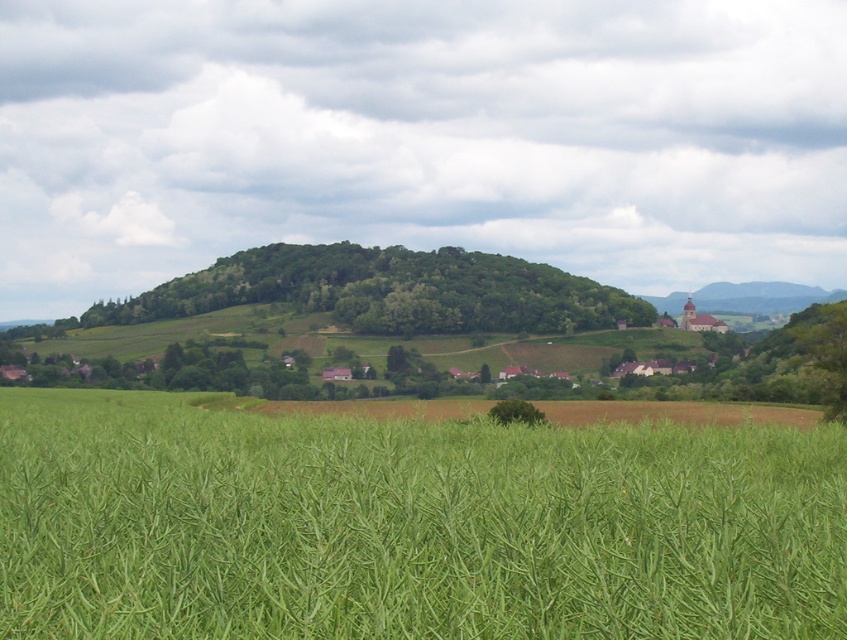
Question: Among these objects, which one is farthest from the camera?

Choices:
 (A) green leafy tree at center
 (B) matte brown church at right

Answer: (B)

Question: Which of these objects is positioned closest to the matte brown church at right?

Choices:
 (A) green grassy field at lower center
 (B) green leafy hill at center
 (C) green leafy tree at center

Answer: (B)

Question: Does green grassy field at lower center have a smaller size compared to matte brown church at right?

Choices:
 (A) yes
 (B) no

Answer: (A)

Question: Considering the relative positions of green grassy field at lower center and green leafy hill at center in the image provided, where is green grassy field at lower center located with respect to green leafy hill at center?

Choices:
 (A) right
 (B) left

Answer: (A)

Question: Which of these objects is positioned closest to the matte brown church at right?

Choices:
 (A) green grassy field at lower center
 (B) green leafy hill at center

Answer: (B)

Question: Does green grassy field at lower center appear under matte brown church at right?

Choices:
 (A) yes
 (B) no

Answer: (A)